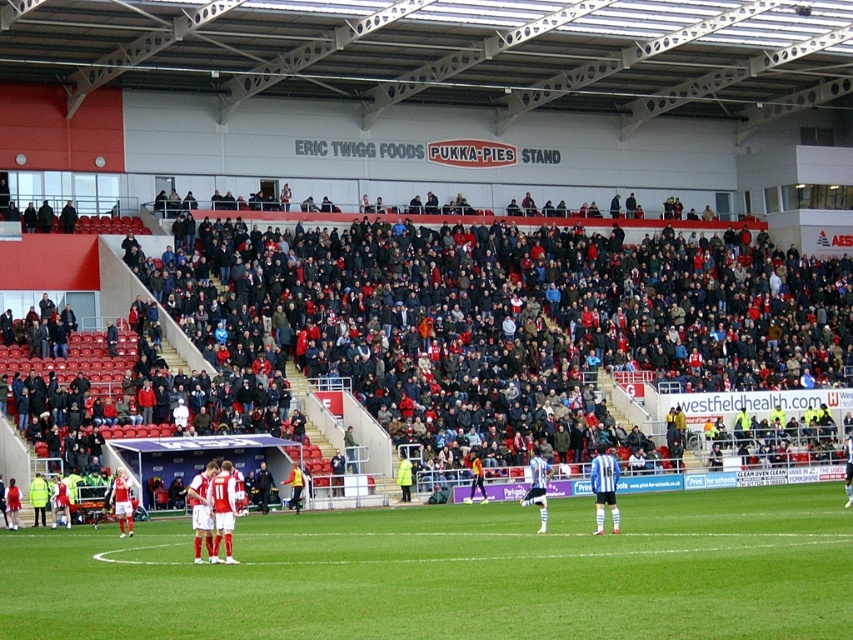
Can you confirm if green grass football field at center is positioned below yellow jersey at center?

No, green grass football field at center is not below yellow jersey at center.

Between green grass football field at center and yellow jersey at center, which one has less height?

yellow jersey at center is shorter.

You are a GUI agent. You are given a task and a screenshot of the screen. Output one action in this format:
    pyautogui.click(x=<x>, y=<y>)
    Task: Click on the green grass football field at center
    The image size is (853, 640).
    Given the screenshot: What is the action you would take?
    pyautogui.click(x=454, y=572)

Is blue jersey at center taller than orange jersey at center?

Correct, blue jersey at center is much taller as orange jersey at center.

Can you confirm if blue jersey at center is thinner than orange jersey at center?

No, blue jersey at center is not thinner than orange jersey at center.

The image size is (853, 640). What are the coordinates of `blue jersey at center` in the screenshot? It's located at (537, 486).

Does blue striped jersey at center have a lesser height compared to red fabric jersey at lower left?

No.

At what (x,y) coordinates should I click in order to perform the action: click on blue striped jersey at center. Please return your answer as a coordinate pair (x, y). The height and width of the screenshot is (640, 853). Looking at the image, I should click on (604, 484).